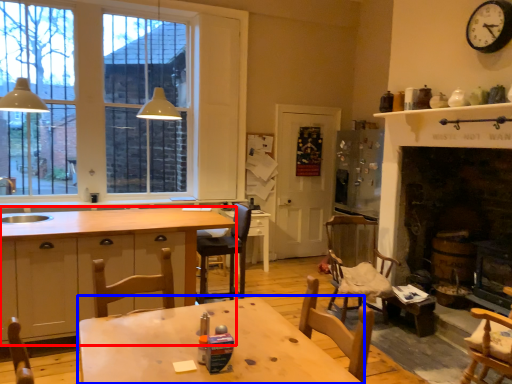
Question: Which object appears closest to the camera in this image, cabinetry (highlighted by a red box) or table (highlighted by a blue box)?

Choices:
 (A) cabinetry
 (B) table

Answer: (B)